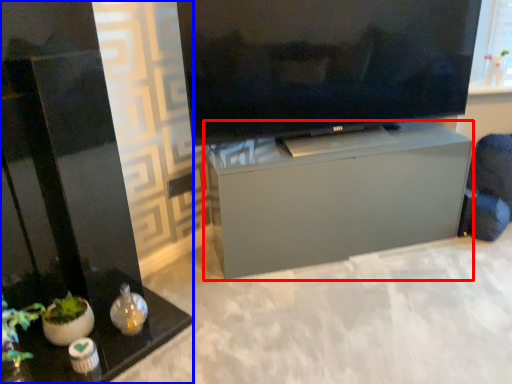
Question: Which object appears closest to the camera in this image, furniture (highlighted by a red box) or furniture (highlighted by a blue box)?

Choices:
 (A) furniture
 (B) furniture

Answer: (B)